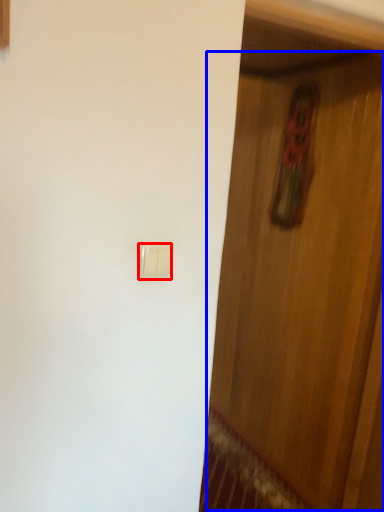
Question: Among these objects, which one is farthest to the camera, light switch (highlighted by a red box) or door (highlighted by a blue box)?

Choices:
 (A) light switch
 (B) door

Answer: (B)